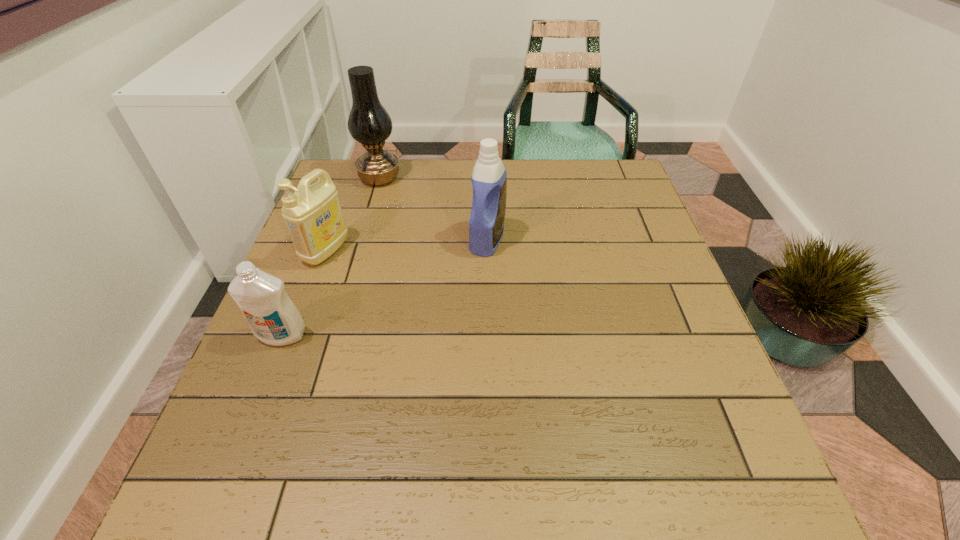
You are a GUI agent. You are given a task and a screenshot of the screen. Output one action in this format:
    pyautogui.click(x=<x>, y=<y>)
    Task: Click on the free space between the nearest object and the rightmost object
    
    Given the screenshot: What is the action you would take?
    pyautogui.click(x=385, y=288)

Where is `free spot between the oil lamp and the nearest detergent`? free spot between the oil lamp and the nearest detergent is located at coordinates (331, 256).

Identify which object is the nearest to the nearest object. Please provide its 2D coordinates. Your answer should be formatted as a tuple, i.e. [(x, y)], where the tuple contains the x and y coordinates of a point satisfying the conditions above.

[(313, 215)]

Point out which object is positioned as the nearest to the rightmost object. Please provide its 2D coordinates. Your answer should be formatted as a tuple, i.e. [(x, y)], where the tuple contains the x and y coordinates of a point satisfying the conditions above.

[(369, 123)]

Where is `detergent that stands as the closest to the nearest detergent`? detergent that stands as the closest to the nearest detergent is located at coordinates (313, 215).

Locate an element on the screen. The height and width of the screenshot is (540, 960). the second closest detergent to the third shortest object is located at coordinates (272, 317).

Identify the location of free region that satisfies the following two spatial constraints: 1. on the back side of the nearest detergent; 2. on the right side of the farthest object. The width and height of the screenshot is (960, 540). (345, 178).

Locate an element on the screen. This screenshot has width=960, height=540. free region that satisfies the following two spatial constraints: 1. on the back side of the farthest object; 2. on the right side of the nearest object is located at coordinates (345, 178).